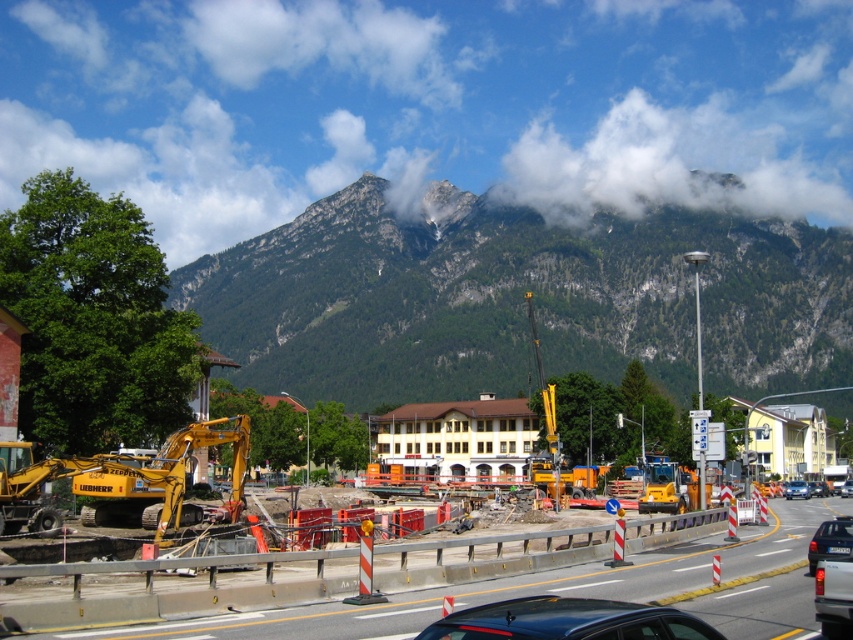
Question: Is concrete barrier at center to the left of metallic silver sedan at center from the viewer's perspective?

Choices:
 (A) no
 (B) yes

Answer: (B)

Question: Which point is farther to the camera?

Choices:
 (A) tap(595, 481)
 (B) tap(827, 496)
 (C) tap(801, 481)

Answer: (C)

Question: Is concrete barrier at center below yellow metallic crane at center?

Choices:
 (A) no
 (B) yes

Answer: (B)

Question: Is concrete barrier at center positioned in front of metallic silver car at lower right?

Choices:
 (A) no
 (B) yes

Answer: (A)

Question: Which point is closer to the camera taking this photo?

Choices:
 (A) (540, 611)
 (B) (792, 483)
 (C) (825, 600)
 (D) (657, 570)

Answer: (A)

Question: Which point is farther to the camera?

Choices:
 (A) (811, 496)
 (B) (814, 593)
 (C) (575, 474)
 (D) (537, 637)

Answer: (A)